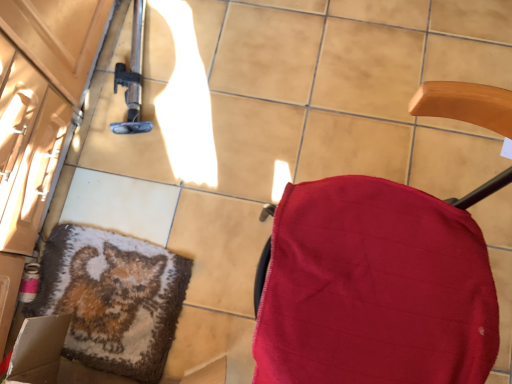
Question: Considering the positions of red fabric chair at right and fluffy woolen mat at lower left in the image, is red fabric chair at right bigger or smaller than fluffy woolen mat at lower left?

Choices:
 (A) small
 (B) big

Answer: (B)

Question: Considering the positions of point (506, 124) and point (70, 276), is point (506, 124) closer or farther from the camera than point (70, 276)?

Choices:
 (A) farther
 (B) closer

Answer: (B)

Question: Is red fabric chair at right in front of or behind fluffy woolen mat at lower left in the image?

Choices:
 (A) behind
 (B) front

Answer: (B)

Question: From the image's perspective, is fluffy woolen mat at lower left above or below red fabric chair at right?

Choices:
 (A) above
 (B) below

Answer: (B)

Question: Based on their sizes in the image, would you say fluffy woolen mat at lower left is bigger or smaller than red fabric chair at right?

Choices:
 (A) big
 (B) small

Answer: (B)

Question: Is fluffy woolen mat at lower left in front of or behind red fabric chair at right in the image?

Choices:
 (A) behind
 (B) front

Answer: (A)

Question: In terms of width, does fluffy woolen mat at lower left look wider or thinner when compared to red fabric chair at right?

Choices:
 (A) wide
 (B) thin

Answer: (B)